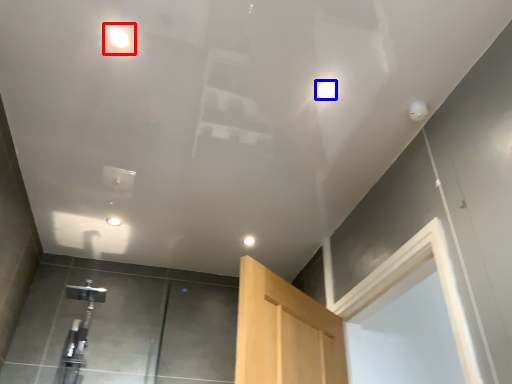
Question: Which point is further to the camera, droplight (highlighted by a red box) or droplight (highlighted by a blue box)?

Choices:
 (A) droplight
 (B) droplight

Answer: (B)